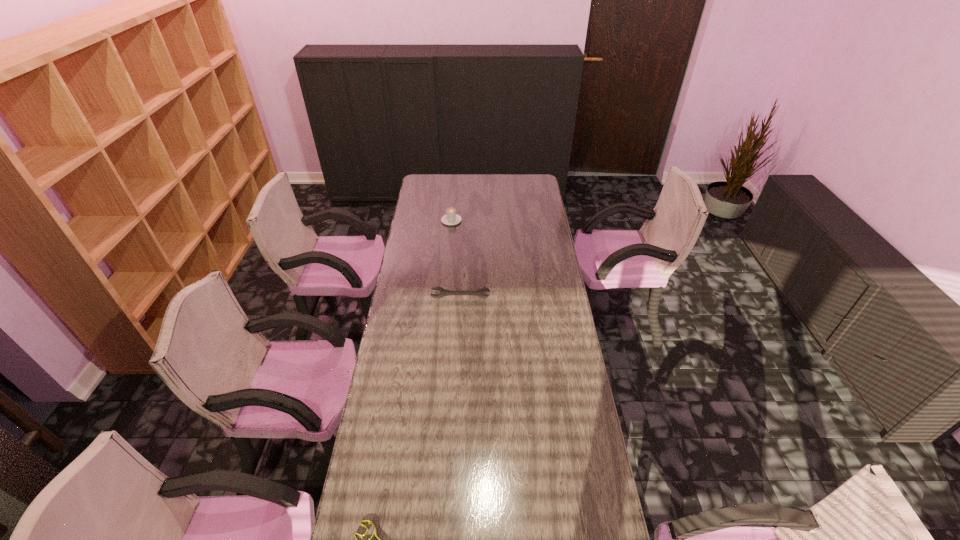
Identify the location of cappuccino. This screenshot has width=960, height=540. (451, 218).

Locate an element on the screen. The width and height of the screenshot is (960, 540). the second farthest object is located at coordinates (443, 292).

This screenshot has height=540, width=960. I want to click on the farther wrench, so click(x=443, y=292).

The height and width of the screenshot is (540, 960). Identify the location of free space located to the right of the cappuccino. (454, 194).

Locate an element on the screen. This screenshot has width=960, height=540. free spot located to the right of the cappuccino is located at coordinates (454, 191).

Identify the location of vacant area located to the right of the cappuccino. (455, 179).

This screenshot has height=540, width=960. What are the coordinates of `free space located on the open ends of the farther wrench` in the screenshot? It's located at (457, 368).

Identify the location of object positioned at the left edge. The height and width of the screenshot is (540, 960). (443, 292).

Image resolution: width=960 pixels, height=540 pixels. In the image, there is a desktop. Identify the location of free space at the far edge. (461, 180).

Locate an element on the screen. This screenshot has height=540, width=960. free space at the left edge of the desktop is located at coordinates 399,372.